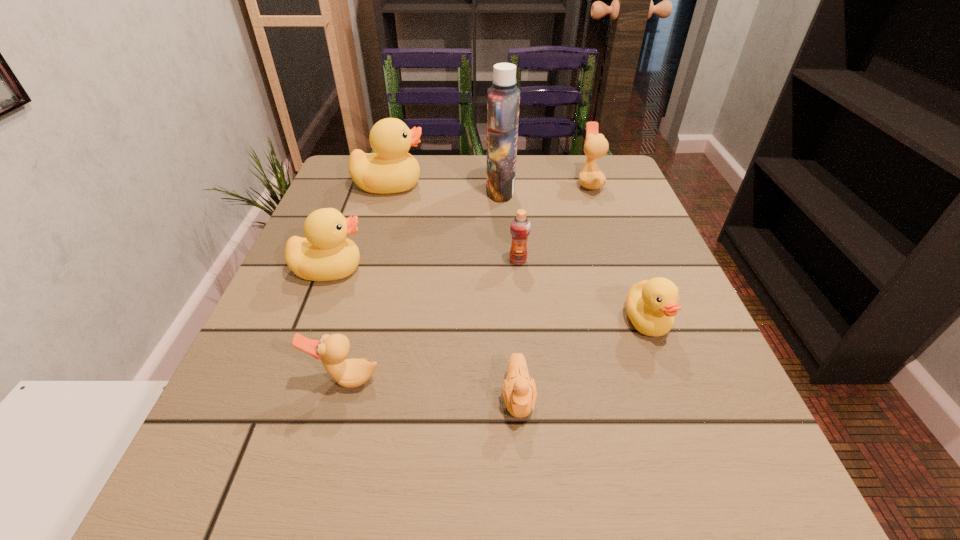
Locate an element on the screen. This screenshot has height=540, width=960. free space that is in between the second biggest yellow duck and the orange juice is located at coordinates (423, 265).

I want to click on vacant space in between the tallest object and the third nearest duck, so click(x=415, y=230).

The width and height of the screenshot is (960, 540). Find the location of `free spot between the farthest yellow duck and the duckling`. free spot between the farthest yellow duck and the duckling is located at coordinates (454, 291).

You are a GUI agent. You are given a task and a screenshot of the screen. Output one action in this format:
    pyautogui.click(x=<x>, y=<y>)
    Task: Click on the vacant space in between the nearest duck and the duckling
    This screenshot has height=540, width=960.
    Given the screenshot: What is the action you would take?
    pyautogui.click(x=432, y=388)

This screenshot has width=960, height=540. I want to click on free space that is in between the rightmost yellow duck and the second biggest yellow duck, so click(x=489, y=295).

Find the location of a particular element. vacant point located between the nearest duck and the farthest yellow duck is located at coordinates (368, 282).

Image resolution: width=960 pixels, height=540 pixels. Identify the location of unoccupied position between the blue shampoo and the nearer tan duck. (422, 285).

I want to click on object identified as the fourth closest to the second biggest yellow duck, so click(x=503, y=98).

Identify which object is the third nearest to the shortest object. Please provide its 2D coordinates. Your answer should be formatted as a tuple, i.e. [(x, y)], where the tuple contains the x and y coordinates of a point satisfying the conditions above.

[(520, 226)]

Identify which duck is located as the second nearest to the second farthest yellow duck. Please provide its 2D coordinates. Your answer should be formatted as a tuple, i.e. [(x, y)], where the tuple contains the x and y coordinates of a point satisfying the conditions above.

[(390, 169)]